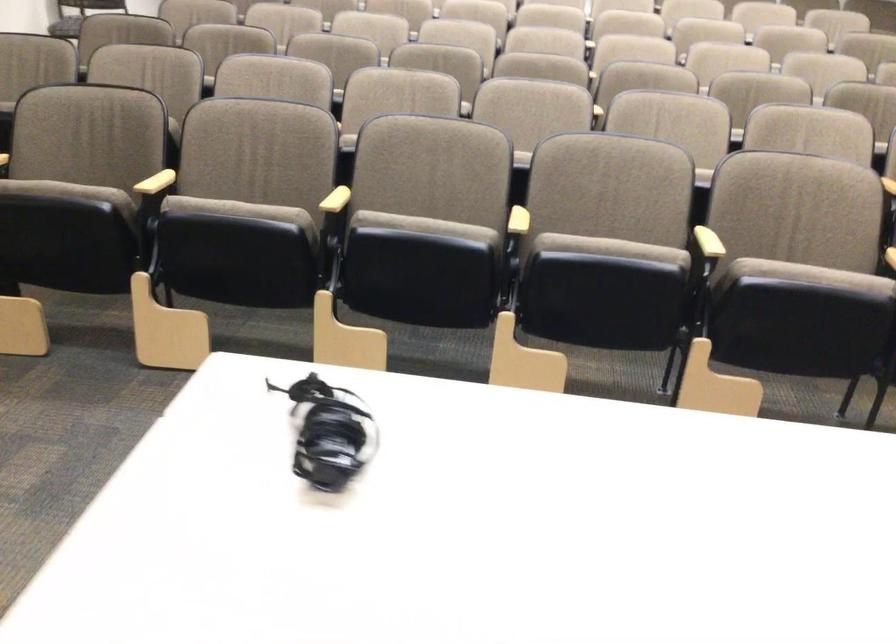
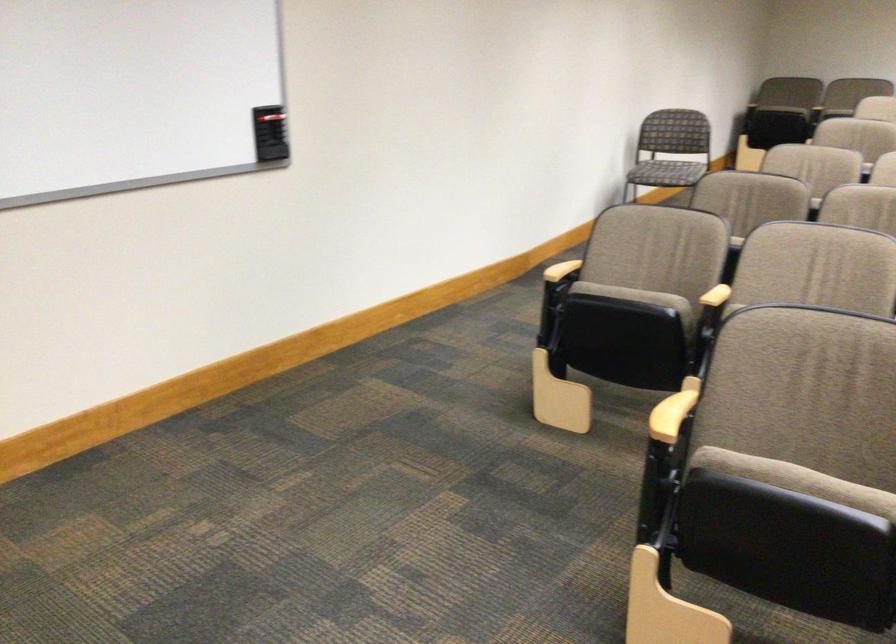
Find the pixel in the second image that matches pixel 83 180 in the first image.

(796, 480)